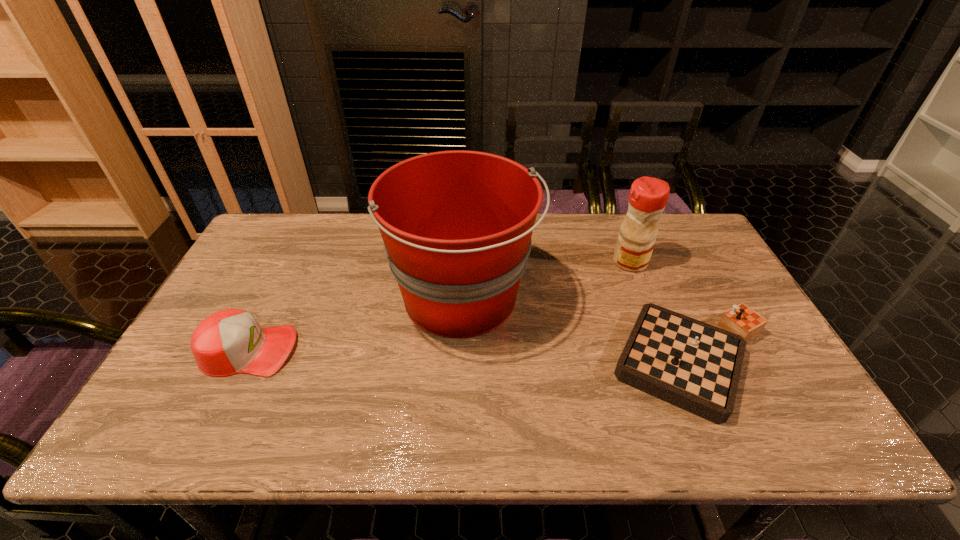
Identify which object is located as the third nearest to the leftmost object. Please provide its 2D coordinates. Your answer should be formatted as a tuple, i.e. [(x, y)], where the tuple contains the x and y coordinates of a point satisfying the conditions above.

[(648, 196)]

Where is `free space that satisfies the following two spatial constraints: 1. on the front side of the shortest object; 2. on the right side of the third object from right to left`? free space that satisfies the following two spatial constraints: 1. on the front side of the shortest object; 2. on the right side of the third object from right to left is located at coordinates (460, 363).

Locate an element on the screen. The height and width of the screenshot is (540, 960). vacant area that satisfies the following two spatial constraints: 1. on the front-facing side of the chessboard; 2. on the right side of the leftmost object is located at coordinates (243, 363).

This screenshot has height=540, width=960. I want to click on vacant space that satisfies the following two spatial constraints: 1. on the front side of the condiment; 2. on the left side of the shortest object, so click(x=670, y=363).